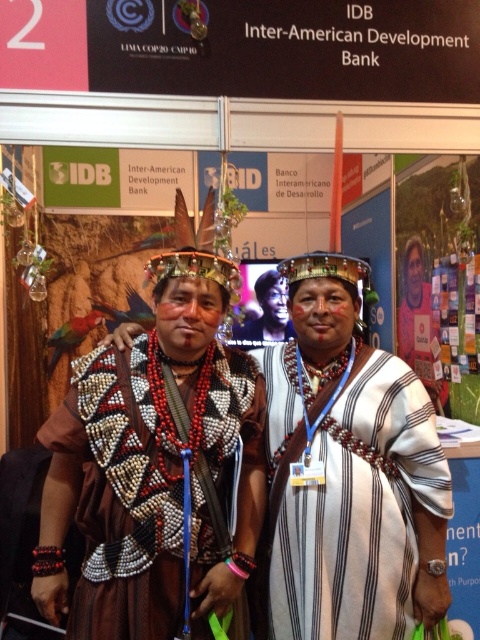
Can you confirm if matte brown feathers at center is taller than beaded fabric vest at center?

Yes.

Does point (228, 570) come behind point (160, 472)?

That is True.

Where is `matte brown feathers at center`? The height and width of the screenshot is (640, 480). matte brown feathers at center is located at coordinates (156, 470).

Is white striped fabric at center shorter than matte black headdress at center?

No.

Which is behind, point (372, 410) or point (252, 346)?

The point (252, 346) is more distant.

Identify the location of white striped fabric at center. This screenshot has height=640, width=480. (346, 502).

Measure the distance between beaded fabric vest at center and camera.

beaded fabric vest at center is 1.40 meters away from camera.

Identify the location of beaded fabric vest at center. The image size is (480, 640). (122, 497).